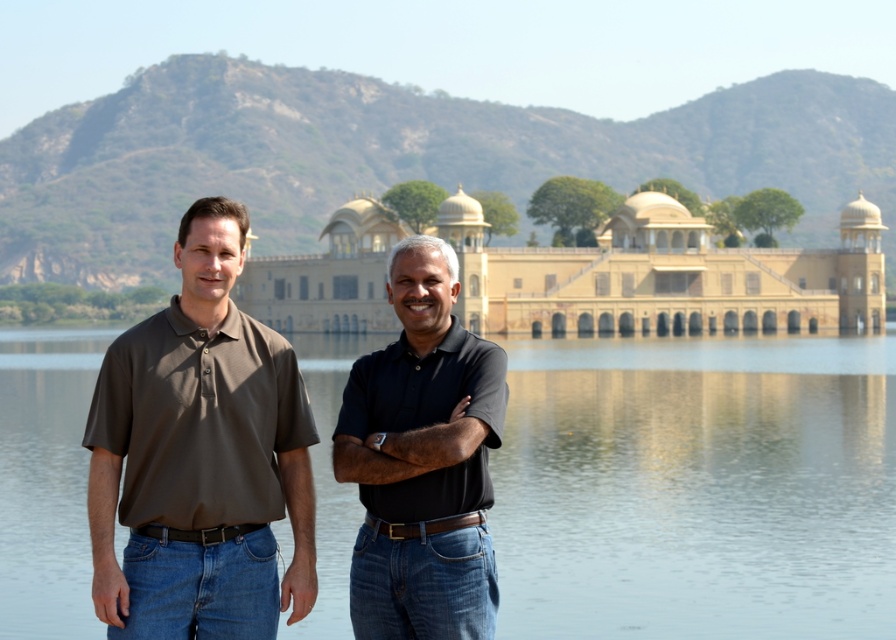
You are a photographer standing at the position of the person wearing the matte brown shirt at left. You want to capture a photo of the historic building in the background through the clear water at center. Considering the distance between you and the water, is it feasible to frame the building in the reflection of the water?

The clear water at center is 71.21 meters from matte brown shirt at left. Since the water is far away, it would be challenging to frame the historic building in its reflection due to the distance.

You are standing at the edge of the lake and want to take a photo of the historic building in the background. The camera you have can focus on objects up to 35 meters away. Is the clear water at center within the camera focus range?

The clear water at center is 36.21 meters away from the viewer. Since the camera can focus up to 35 meters, the clear water at center is slightly beyond the camera focus range.

In the scene shown: You are a photographer planning to take a photo of the matte brown shirt at left and the clear water at center. Based on their positions, which object is located to the left of the other?

The matte brown shirt at left is located to the left of the clear water at center because the clear water at center is positioned on the right side of the matte brown shirt at left.